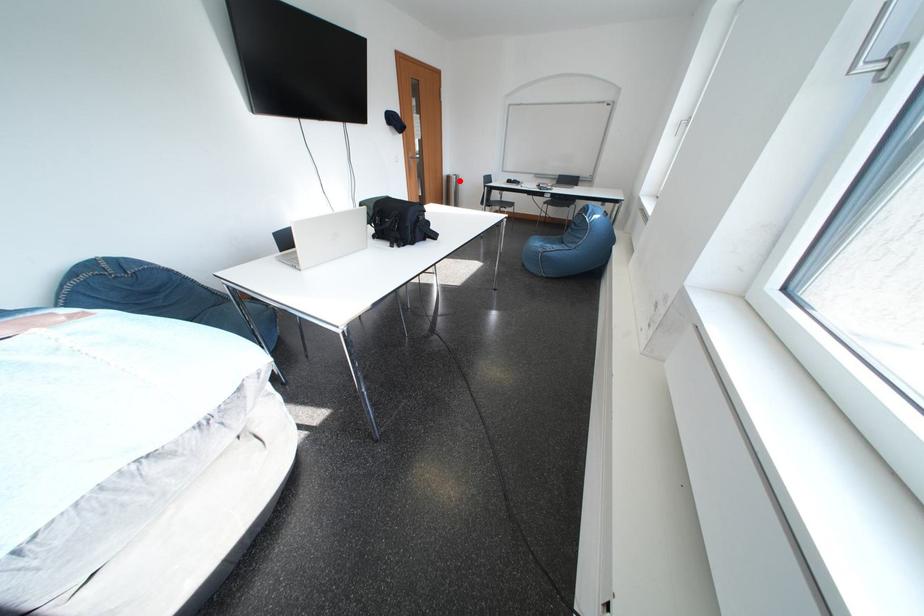
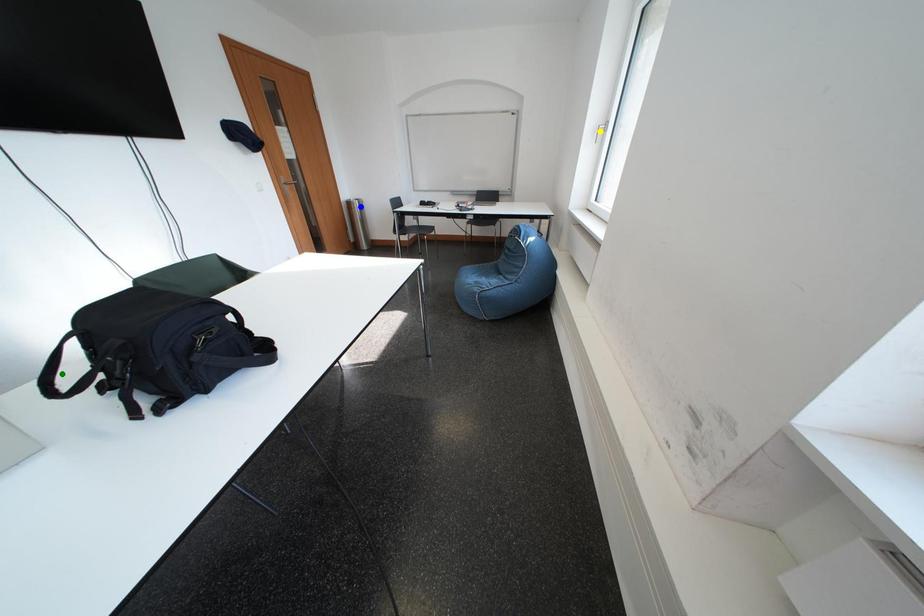
Question: I am providing you with two images of the same scene from different viewpoints. A red point is marked on the first image. You are given multiple points on the second image. Which mark in image 2 goes with the point in image 1?

Choices:
 (A) blue point
 (B) green point
 (C) yellow point

Answer: (A)